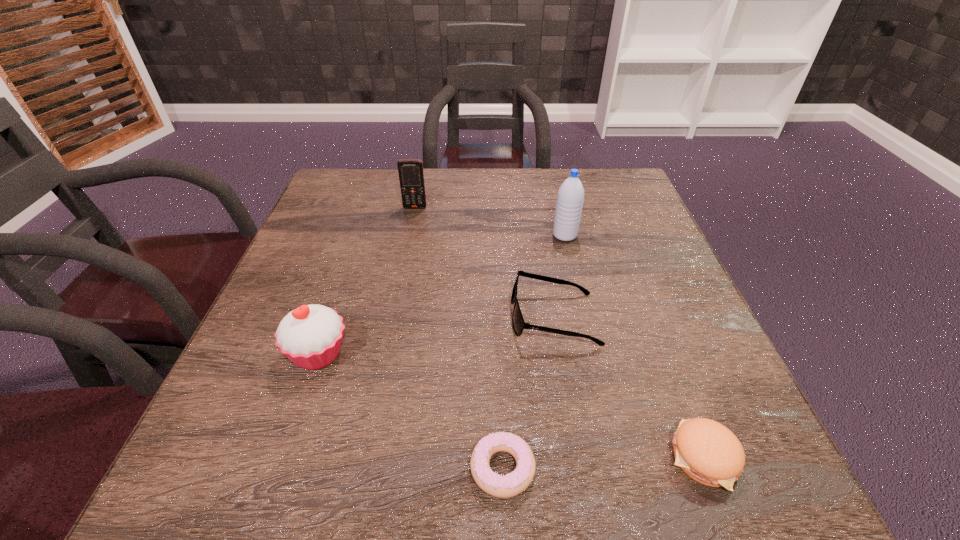
Where is `the tallest object`? the tallest object is located at coordinates (570, 198).

Where is `the fifth nearest object`? the fifth nearest object is located at coordinates (570, 198).

Where is `cellular telephone`? The image size is (960, 540). cellular telephone is located at coordinates (411, 176).

This screenshot has width=960, height=540. Find the location of `the farthest object`. the farthest object is located at coordinates (411, 176).

Where is `cupcake`? The width and height of the screenshot is (960, 540). cupcake is located at coordinates (310, 336).

Find the location of a particular element. Image resolution: width=960 pixels, height=540 pixels. the leftmost object is located at coordinates (310, 336).

What are the coordinates of `sunglasses` in the screenshot? It's located at (519, 325).

The height and width of the screenshot is (540, 960). Find the location of `patty`. patty is located at coordinates (707, 451).

The width and height of the screenshot is (960, 540). Find the location of `the second shortest object`. the second shortest object is located at coordinates (707, 451).

Locate an element on the screen. doughnut is located at coordinates (512, 484).